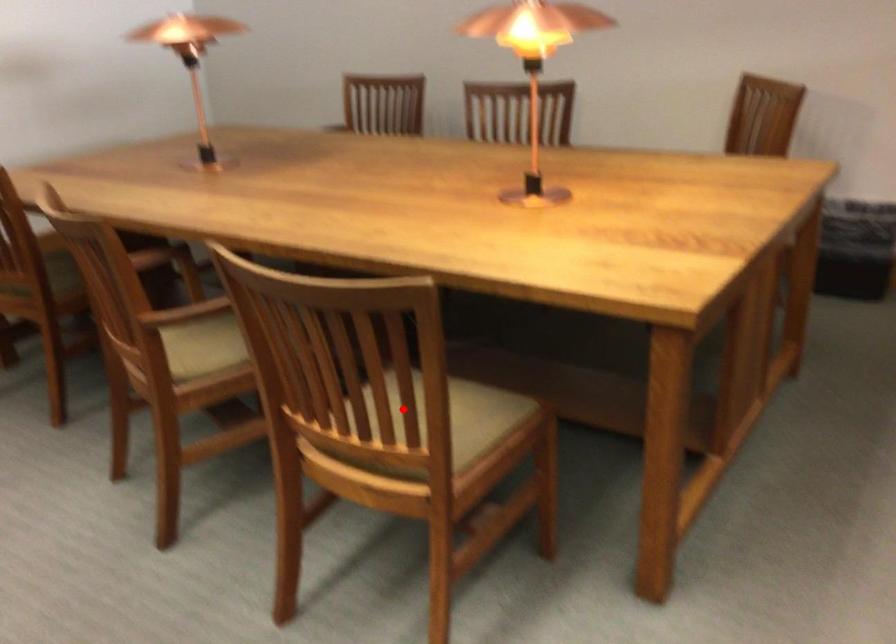
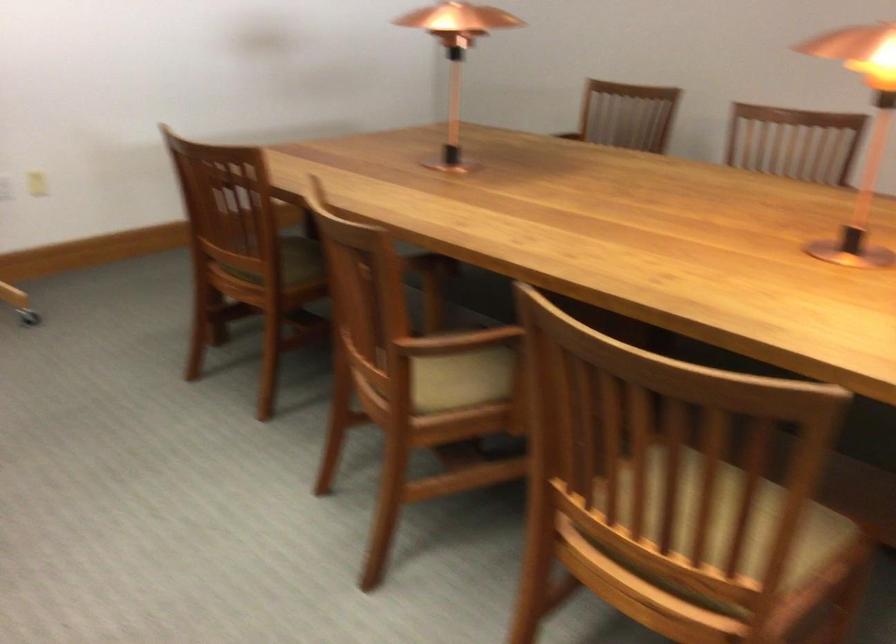
Question: I am providing you with two images of the same scene from different viewpoints. A red point is shown in image1. For the corresponding object point in image2, is it positioned nearer or farther from the camera?

Choices:
 (A) Nearer
 (B) Farther

Answer: (A)